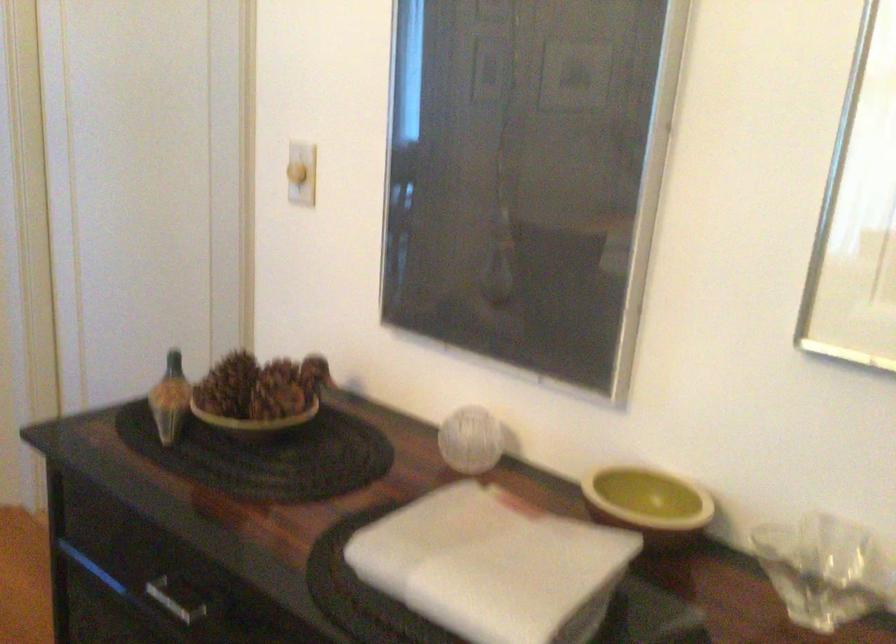
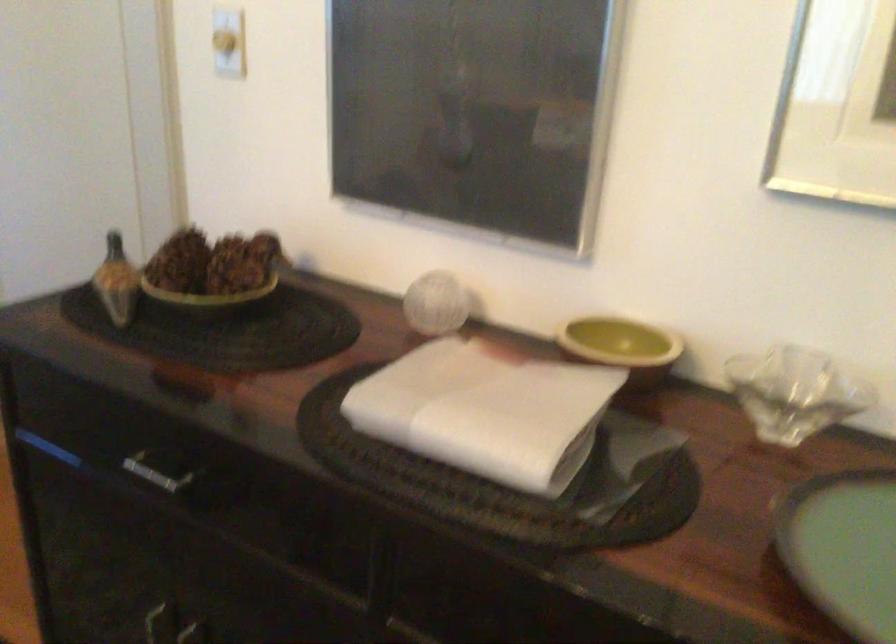
Question: Which direction would the cameraman need to move to produce the second image? Reply with the corresponding letter.

Choices:
 (A) Left
 (B) Right
 (C) Forward
 (D) Backward

Answer: (A)